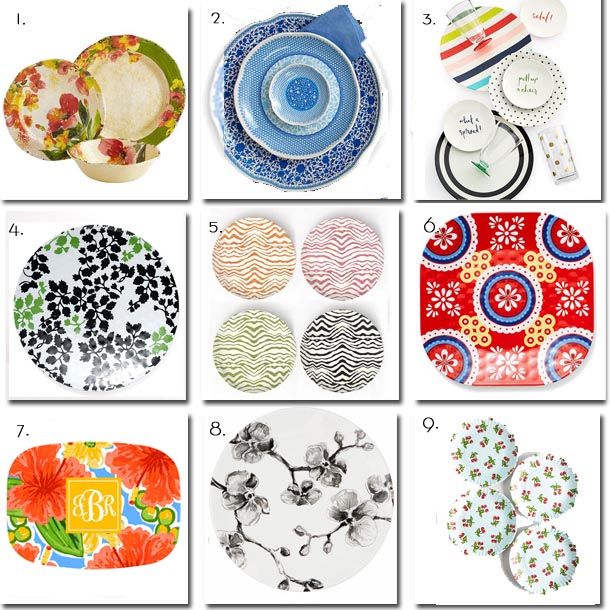
Where is `white plate with black polka dots`? The height and width of the screenshot is (610, 610). white plate with black polka dots is located at coordinates (510, 112).